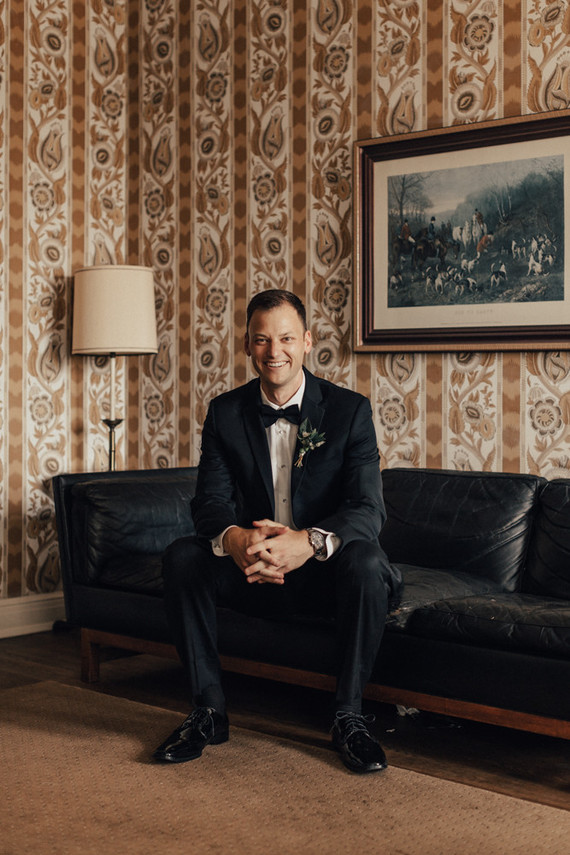
You are a GUI agent. You are given a task and a screenshot of the screen. Output one action in this format:
    pyautogui.click(x=<x>, y=<y>)
    Task: Click on the picture
    This screenshot has width=570, height=855.
    Given the screenshot: What is the action you would take?
    pyautogui.click(x=456, y=286)